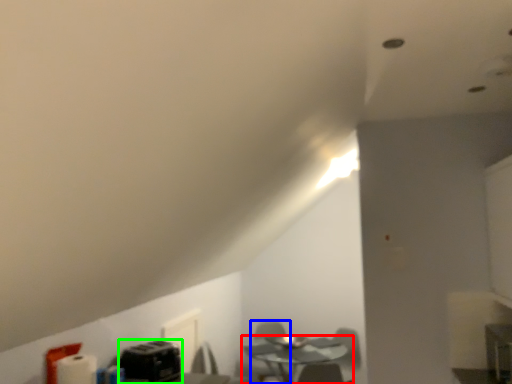
Question: Which is nearer to the table (highlighted by a red box)? swivel chair (highlighted by a blue box) or appliance (highlighted by a green box).

Choices:
 (A) swivel chair
 (B) appliance

Answer: (A)